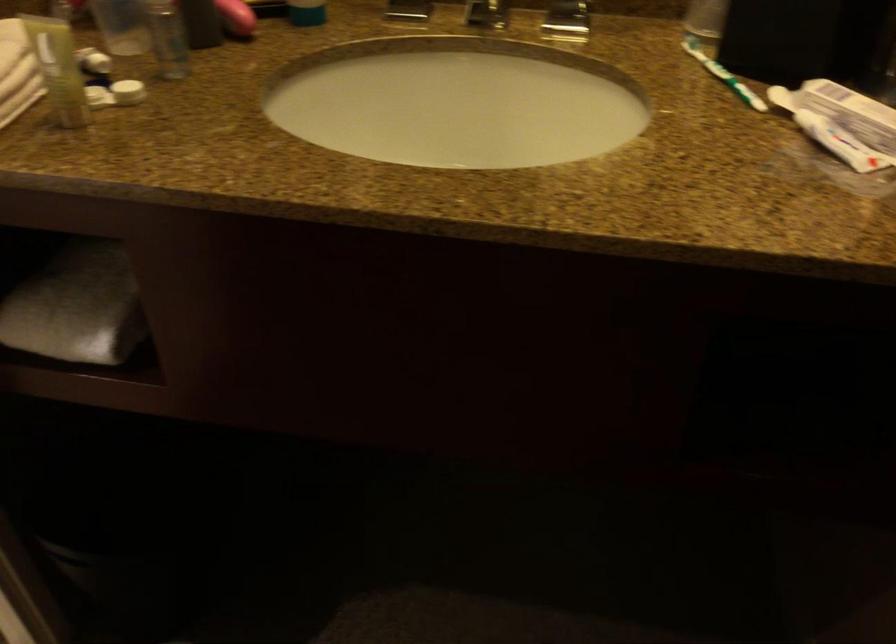
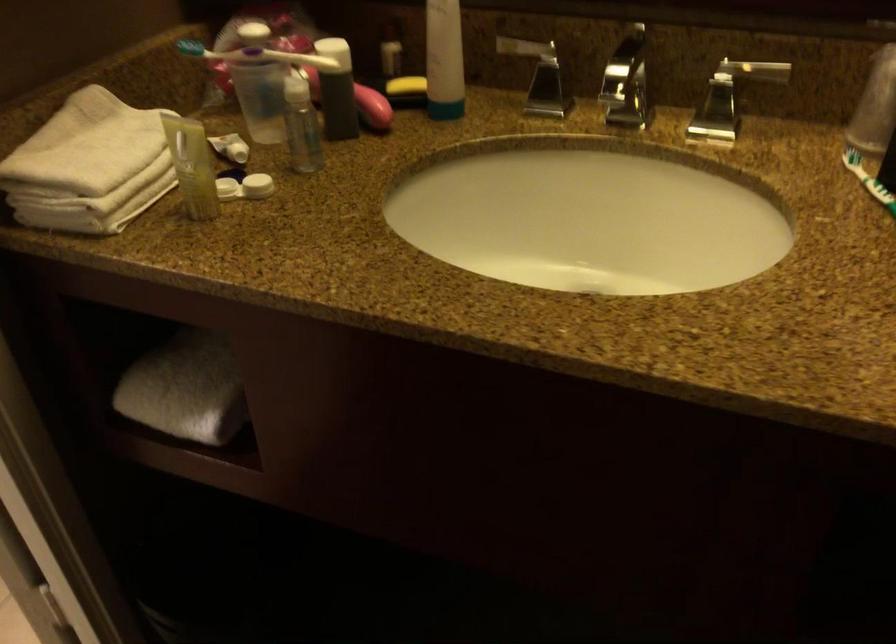
Question: The camera is either moving clockwise (left) or counter-clockwise (right) around the object. The first image is from the beginning of the video and the second image is from the end. Is the camera moving left or right when shooting the video?

Choices:
 (A) Left
 (B) Right

Answer: (B)